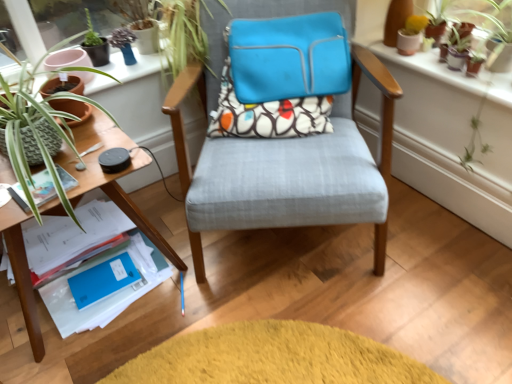
Question: From a real-world perspective, is textured fabric chair at center, marked as the second chair in a back-to-front arrangement, on matte blue laptop case at center, which appears as the 2th chair when viewed from the front?

Choices:
 (A) yes
 (B) no

Answer: (B)

Question: Is textured fabric chair at center, marked as the 1th chair in a front-to-back arrangement, facing towards matte blue laptop case at center, which appears as the 2th chair when viewed from the front?

Choices:
 (A) no
 (B) yes

Answer: (A)

Question: Is textured fabric chair at center, marked as the 1th chair in a front-to-back arrangement, not inside matte blue laptop case at center, which appears as the 2th chair when viewed from the front?

Choices:
 (A) yes
 (B) no

Answer: (A)

Question: Is textured fabric chair at center, marked as the 1th chair in a front-to-back arrangement, thinner than matte blue laptop case at center, which appears as the 1th chair when viewed from the back?

Choices:
 (A) no
 (B) yes

Answer: (A)

Question: Are textured fabric chair at center, marked as the 1th chair in a front-to-back arrangement, and matte blue laptop case at center, which appears as the 1th chair when viewed from the back, making contact?

Choices:
 (A) no
 (B) yes

Answer: (A)

Question: Does textured fabric chair at center, marked as the second chair in a back-to-front arrangement, have a lesser height compared to matte blue laptop case at center, which appears as the 2th chair when viewed from the front?

Choices:
 (A) no
 (B) yes

Answer: (A)

Question: Can you confirm if patterned fabric pillow at center is taller than blue matte paper at lower left, arranged as the first paperback book when ordered from the bottom?

Choices:
 (A) no
 (B) yes

Answer: (B)

Question: Are patterned fabric pillow at center and blue matte paper at lower left, arranged as the first paperback book when ordered from the bottom, making contact?

Choices:
 (A) no
 (B) yes

Answer: (A)

Question: Does patterned fabric pillow at center have a lesser width compared to blue matte paper at lower left, arranged as the first paperback book when ordered from the bottom?

Choices:
 (A) no
 (B) yes

Answer: (A)

Question: Does patterned fabric pillow at center appear on the right side of blue matte paper at lower left, the second paperback book viewed from the front?

Choices:
 (A) no
 (B) yes

Answer: (B)

Question: From the image's perspective, is patterned fabric pillow at center on top of blue matte paper at lower left, the second paperback book viewed from the front?

Choices:
 (A) no
 (B) yes

Answer: (B)

Question: From a real-world perspective, is patterned fabric pillow at center on blue matte paper at lower left, arranged as the first paperback book when ordered from the bottom?

Choices:
 (A) no
 (B) yes

Answer: (B)

Question: From a real-world perspective, is blue matte paper at lower left, marked as the second paperback book in a top-to-bottom arrangement, over terracotta clay pots at upper right?

Choices:
 (A) yes
 (B) no

Answer: (B)